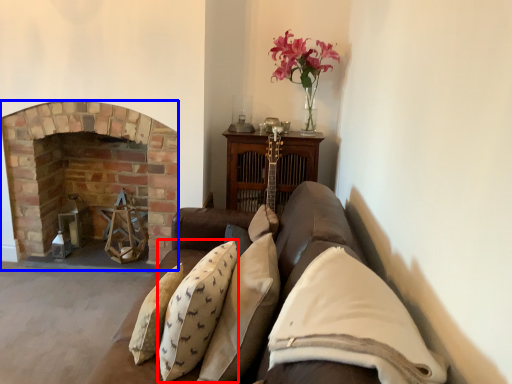
Question: Which object is closer to the camera taking this photo, pillow (highlighted by a red box) or fireplace (highlighted by a blue box)?

Choices:
 (A) pillow
 (B) fireplace

Answer: (A)